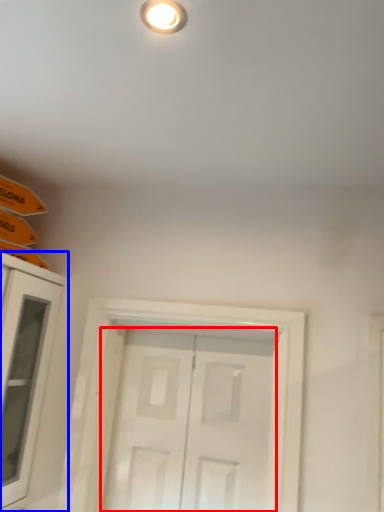
Question: Which of the following is the closest to the observer, door (highlighted by a red box) or cabinetry (highlighted by a blue box)?

Choices:
 (A) door
 (B) cabinetry

Answer: (B)